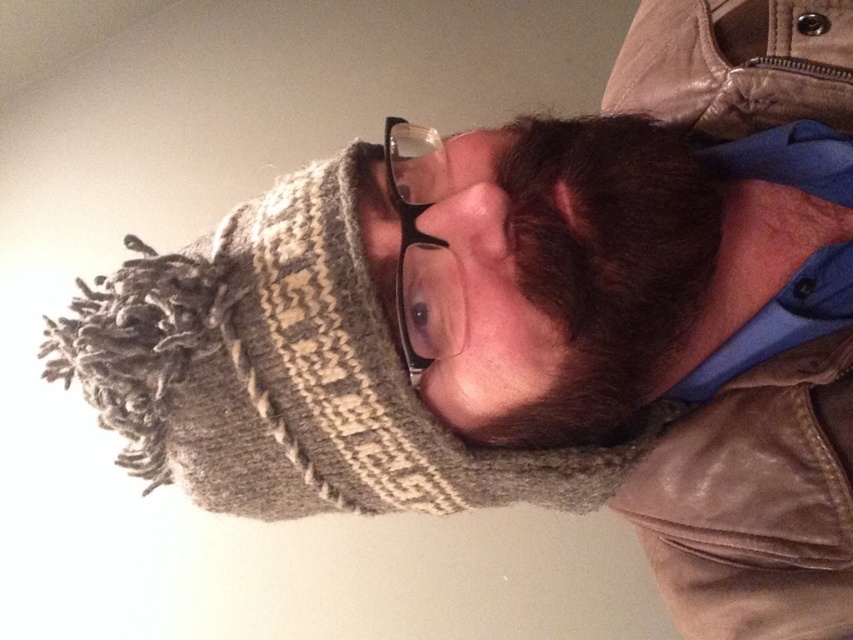
Question: Where is leather jacket at right located in relation to dark brown fuzzy beard at center in the image?

Choices:
 (A) right
 (B) left

Answer: (A)

Question: Which object is closer to the camera taking this photo?

Choices:
 (A) leather jacket at right
 (B) dark brown fuzzy beard at center

Answer: (B)

Question: Does leather jacket at right have a larger size compared to dark brown fuzzy beard at center?

Choices:
 (A) yes
 (B) no

Answer: (A)

Question: Among these objects, which one is farthest from the camera?

Choices:
 (A) dark brown fuzzy beard at center
 (B) leather jacket at right

Answer: (B)

Question: Considering the relative positions of leather jacket at right and dark brown fuzzy beard at center in the image provided, where is leather jacket at right located with respect to dark brown fuzzy beard at center?

Choices:
 (A) below
 (B) above

Answer: (B)